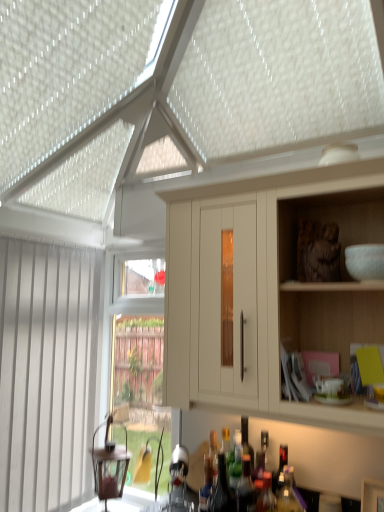
Question: Is white vertical blinds at left outside translucent glass bottle at lower center, acting as the first bottle starting from the left?

Choices:
 (A) no
 (B) yes

Answer: (B)

Question: Is white vertical blinds at left behind translucent glass bottle at lower center, the fifth bottle from the right?

Choices:
 (A) yes
 (B) no

Answer: (A)

Question: Considering the relative sizes of white vertical blinds at left and translucent glass bottle at lower center, acting as the first bottle starting from the left, in the image provided, is white vertical blinds at left shorter than translucent glass bottle at lower center, acting as the first bottle starting from the left,?

Choices:
 (A) no
 (B) yes

Answer: (A)

Question: Can you confirm if white vertical blinds at left is positioned to the right of translucent glass bottle at lower center, acting as the first bottle starting from the left?

Choices:
 (A) no
 (B) yes

Answer: (A)

Question: Is the depth of white vertical blinds at left less than that of translucent glass bottle at lower center, the fifth bottle from the right?

Choices:
 (A) yes
 (B) no

Answer: (B)

Question: Considering the relative sizes of white vertical blinds at left and translucent glass bottle at lower center, the fifth bottle from the right, in the image provided, is white vertical blinds at left thinner than translucent glass bottle at lower center, the fifth bottle from the right,?

Choices:
 (A) yes
 (B) no

Answer: (A)

Question: From a real-world perspective, does translucent glass bottle at center, which is counted as the 1th bottle, starting from the right, sit lower than matte white cabinet at upper right?

Choices:
 (A) no
 (B) yes

Answer: (B)

Question: Is translucent glass bottle at center, acting as the 5th bottle starting from the left, wider than matte white cabinet at upper right?

Choices:
 (A) yes
 (B) no

Answer: (B)

Question: Is translucent glass bottle at center, which is counted as the 1th bottle, starting from the right, positioned beyond the bounds of matte white cabinet at upper right?

Choices:
 (A) yes
 (B) no

Answer: (A)

Question: Is translucent glass bottle at center, acting as the 5th bottle starting from the left, not near matte white cabinet at upper right?

Choices:
 (A) no
 (B) yes

Answer: (A)

Question: Is translucent glass bottle at center, which is counted as the 1th bottle, starting from the right, further to camera compared to matte white cabinet at upper right?

Choices:
 (A) no
 (B) yes

Answer: (B)

Question: From a real-world perspective, is translucent glass bottle at center, acting as the 5th bottle starting from the left, positioned over matte white cabinet at upper right based on gravity?

Choices:
 (A) yes
 (B) no

Answer: (B)

Question: Are white vertical blinds at left and translucent glass bottle at center, positioned as the second bottle in left-to-right order, making contact?

Choices:
 (A) yes
 (B) no

Answer: (B)